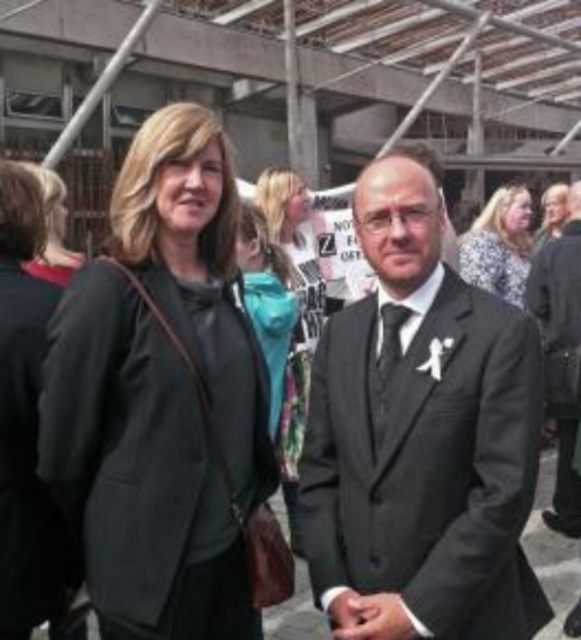
Question: Among these objects, which one is nearest to the camera?

Choices:
 (A) floral-patterned dress at upper right
 (B) black silk tie at center
 (C) matte black blazer at left
 (D) matte black blazer at center

Answer: (C)

Question: Which of these objects is positioned farthest from the matte black blazer at center?

Choices:
 (A) black suit at center
 (B) matte black blazer at left

Answer: (A)

Question: Is matte black blazer at left behind black silk tie at center?

Choices:
 (A) yes
 (B) no

Answer: (B)

Question: Which of the following is the closest to the observer?

Choices:
 (A) (71, 269)
 (B) (562, 220)

Answer: (A)

Question: Does floral-patterned dress at upper right appear on the right side of black silk tie at center?

Choices:
 (A) no
 (B) yes

Answer: (B)

Question: Can you confirm if black suit at center is thinner than matte black jacket at upper right?

Choices:
 (A) yes
 (B) no

Answer: (A)